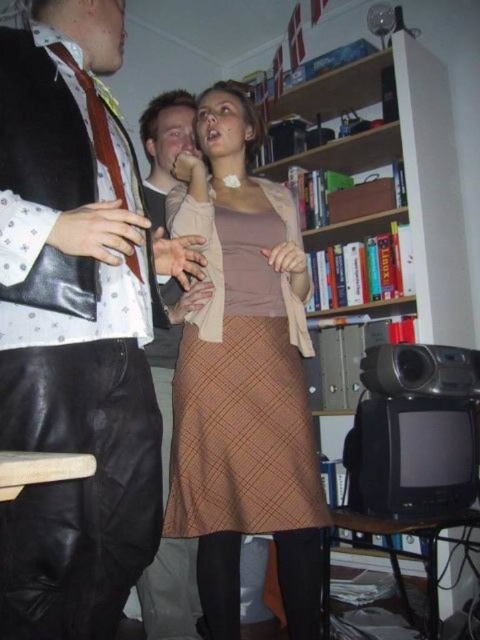
Which of these two, leather pants at center or matte black tie at center, stands taller?

matte black tie at center

Which is in front, point (119, 577) or point (175, 362)?

Positioned in front is point (119, 577).

At what (x,y) coordinates should I click in order to perform the action: click on leather pants at center. Please return your answer as a coordinate pair (x, y). The width and height of the screenshot is (480, 640). Looking at the image, I should click on (75, 326).

Is leather pants at center in front of wooden bookshelf at center?

Yes, it is.

Is point (92, 84) positioned behind point (327, 164)?

No, it is not.

At what (x,y) coordinates should I click in order to perform the action: click on leather pants at center. Please return your answer as a coordinate pair (x, y). Image resolution: width=480 pixels, height=640 pixels. Looking at the image, I should click on tap(75, 326).

Locate an element on the screen. This screenshot has height=640, width=480. leather pants at center is located at coordinates (75, 326).

The height and width of the screenshot is (640, 480). What do you see at coordinates (75, 326) in the screenshot? I see `leather pants at center` at bounding box center [75, 326].

From the picture: Can you confirm if leather pants at center is thinner than brown plaid skirt at center?

Yes, leather pants at center is thinner than brown plaid skirt at center.

Is point (13, 269) closer to camera compared to point (300, 236)?

Yes, point (13, 269) is closer to viewer.

This screenshot has width=480, height=640. I want to click on leather pants at center, so click(x=75, y=326).